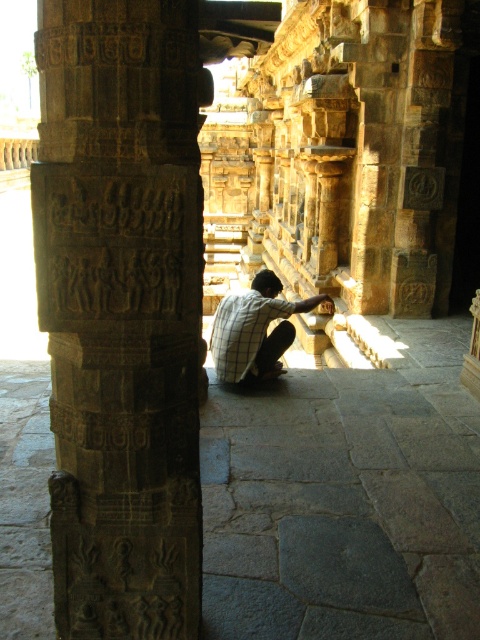
Is dark brown stone pillar at left further to the viewer compared to checkered fabric man at center?

No.

Which is behind, point (129, 273) or point (287, 337)?

Point (287, 337)

This screenshot has height=640, width=480. In order to click on dark brown stone pillar at left in this screenshot , I will do `click(120, 310)`.